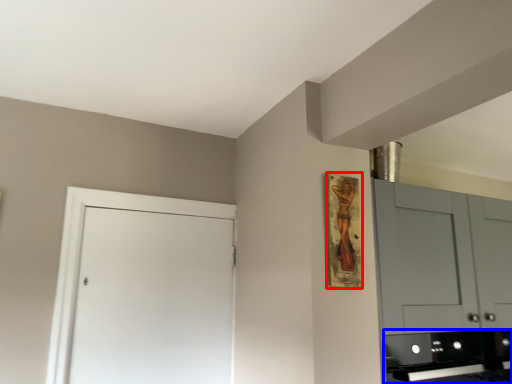
Question: Which of the following is the closest to the observer, picture frame (highlighted by a red box) or appliance (highlighted by a blue box)?

Choices:
 (A) picture frame
 (B) appliance

Answer: (A)